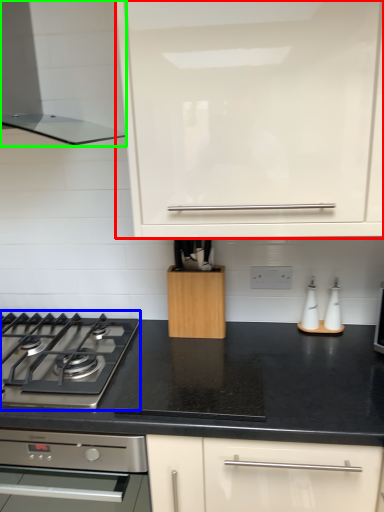
Question: Based on their relative distances, which object is nearer to cabinetry (highlighted by a red box)? Choose from gas stove (highlighted by a blue box) and home appliance (highlighted by a green box).

Choices:
 (A) gas stove
 (B) home appliance

Answer: (B)